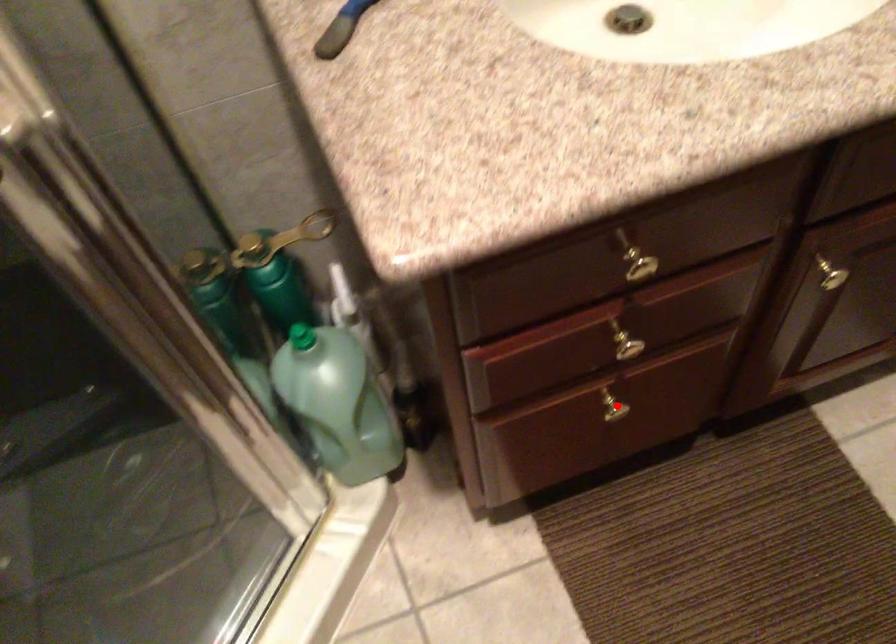
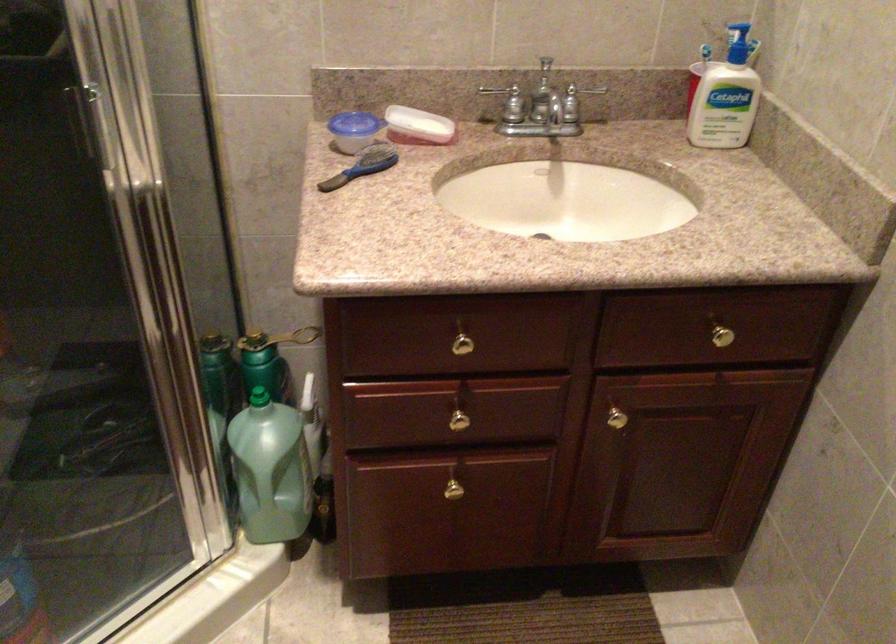
Question: I am providing you with two images of the same scene from different viewpoints. A red point is shown in image1. For the corresponding object point in image2, is it positioned nearer or farther from the camera?

Choices:
 (A) Nearer
 (B) Farther

Answer: (B)